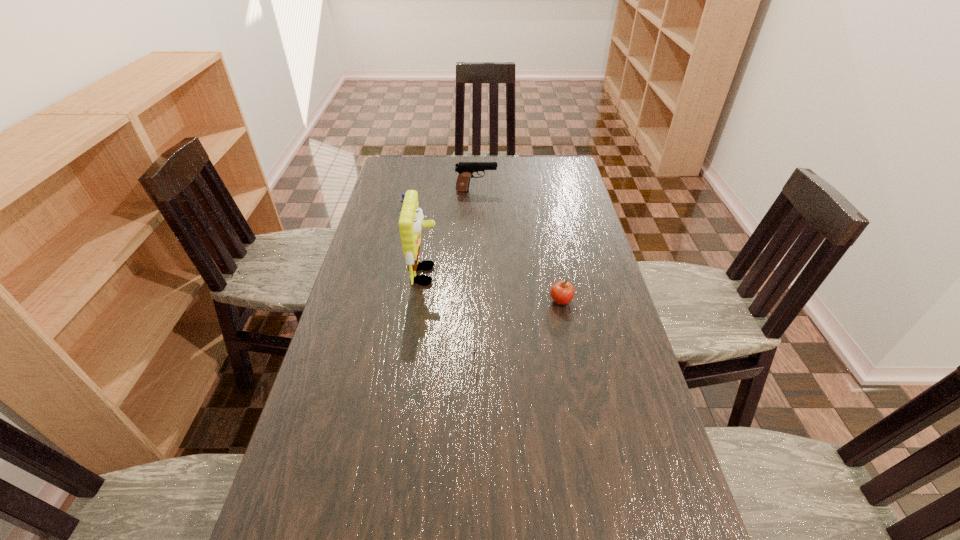
Locate an element on the screen. The width and height of the screenshot is (960, 540). vacant area at the right edge is located at coordinates (590, 238).

The height and width of the screenshot is (540, 960). In order to click on blank space at the far left corner of the desktop in this screenshot , I will do `click(403, 163)`.

This screenshot has width=960, height=540. I want to click on free space at the far right corner of the desktop, so click(x=542, y=159).

Where is `free space between the tallest object and the fourth tallest object`? Image resolution: width=960 pixels, height=540 pixels. free space between the tallest object and the fourth tallest object is located at coordinates (493, 288).

Find the location of a particular element. Image resolution: width=960 pixels, height=540 pixels. free space between the nearest object and the tallest object is located at coordinates (455, 322).

Where is `vacant space in between the farthest object and the second farthest object`? This screenshot has height=540, width=960. vacant space in between the farthest object and the second farthest object is located at coordinates (442, 206).

At what (x,y) coordinates should I click in order to perform the action: click on free spot between the shortest object and the farthest object. Please return your answer as a coordinate pair (x, y). The image size is (960, 540). Looking at the image, I should click on (480, 280).

Locate which object is the second closest to the second farthest object. Please provide its 2D coordinates. Your answer should be formatted as a tuple, i.e. [(x, y)], where the tuple contains the x and y coordinates of a point satisfying the conditions above.

[(465, 170)]

Select which object appears as the third closest to the sunglasses. Please provide its 2D coordinates. Your answer should be formatted as a tuple, i.e. [(x, y)], where the tuple contains the x and y coordinates of a point satisfying the conditions above.

[(403, 194)]

Find the location of a particular element. The height and width of the screenshot is (540, 960). vacant space that satisfies the following two spatial constraints: 1. on the face of the fourth tallest object; 2. on the right side of the fourth object from right to left is located at coordinates (421, 301).